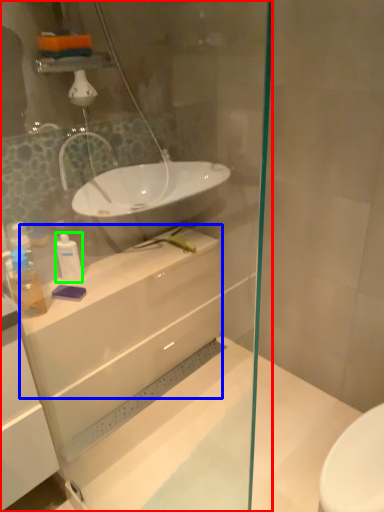
Question: Estimate the real-world distances between objects in this image. Which object is farther from shower door (highlighted by a red box), counter top (highlighted by a blue box) or toiletry (highlighted by a green box)?

Choices:
 (A) counter top
 (B) toiletry

Answer: (B)